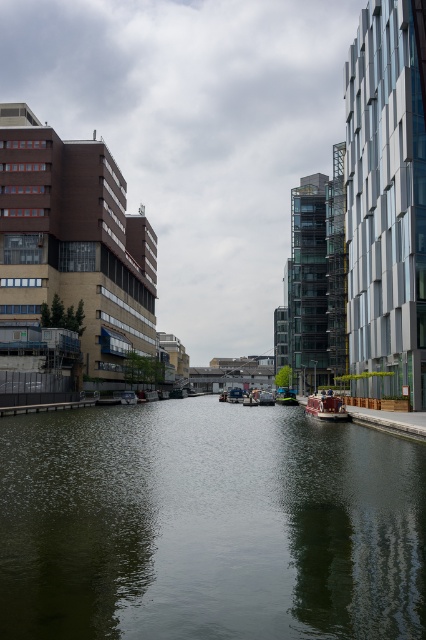
Question: Can you confirm if green reflective water at center is bigger than wooden polished boat at center?

Choices:
 (A) yes
 (B) no

Answer: (A)

Question: Which of the following is the farthest from the observer?

Choices:
 (A) (337, 419)
 (B) (322, 508)

Answer: (A)

Question: Is green reflective water at center thinner than wooden polished boat at center?

Choices:
 (A) yes
 (B) no

Answer: (B)

Question: Among these objects, which one is nearest to the camera?

Choices:
 (A) green reflective water at center
 (B) wooden polished boat at center

Answer: (A)

Question: Does green reflective water at center lie behind wooden polished boat at center?

Choices:
 (A) no
 (B) yes

Answer: (A)